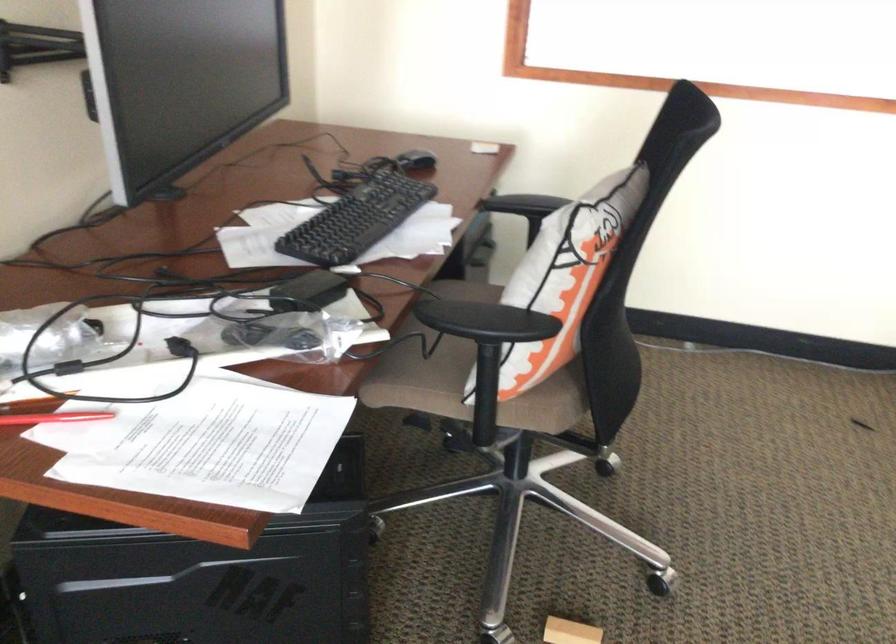
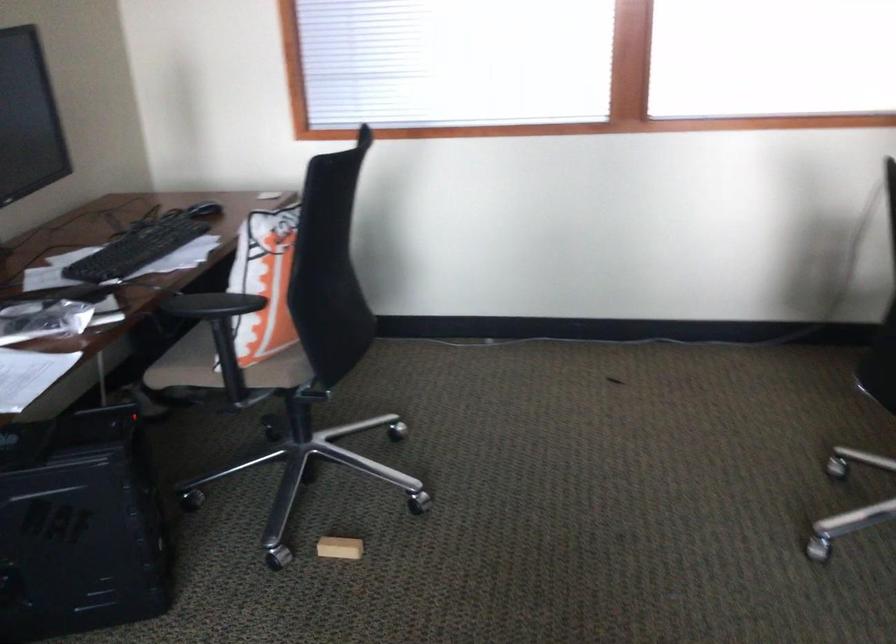
Find the pixel in the second image that matches point 360,219 in the first image.

(138, 248)